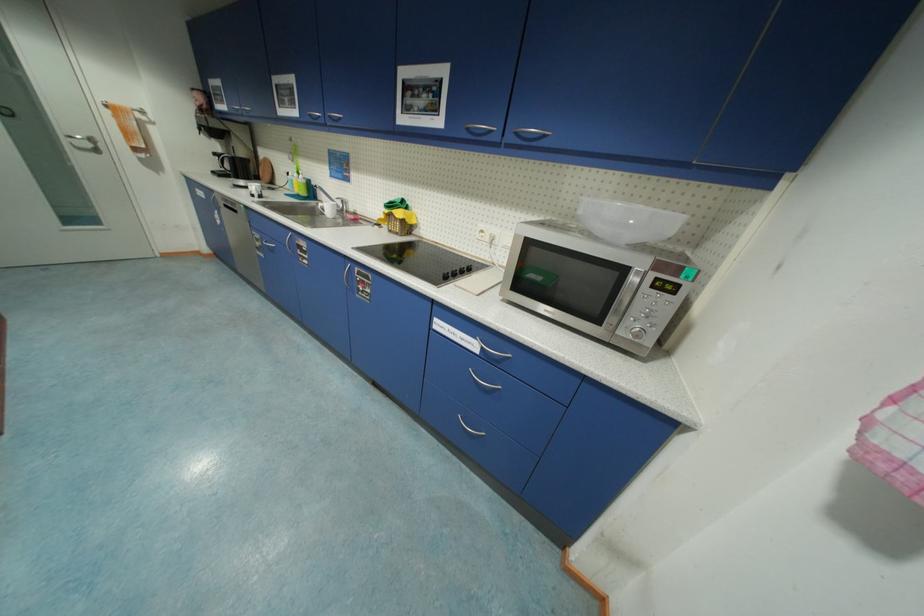
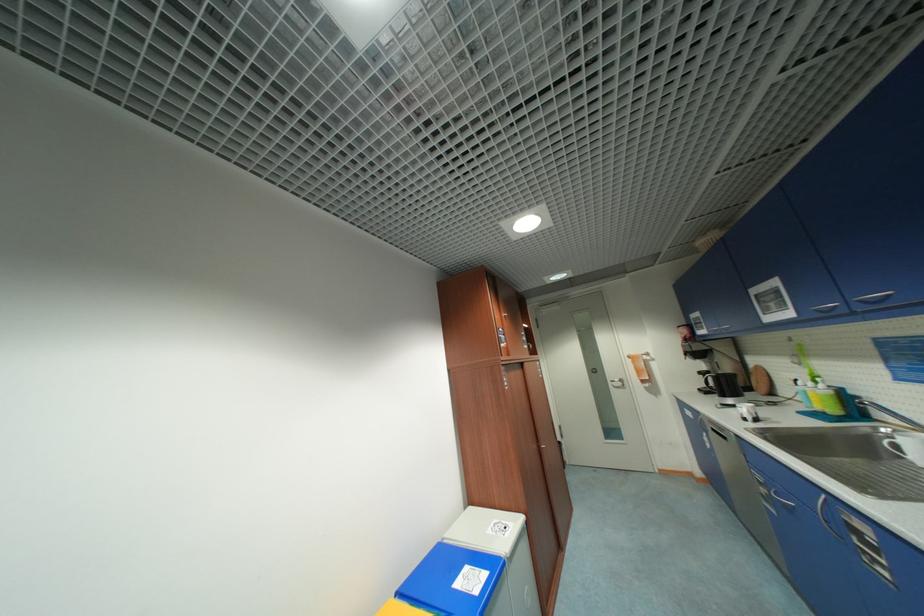
Find the pixel in the second image that matches point 329,214 in the first image.

(906, 458)